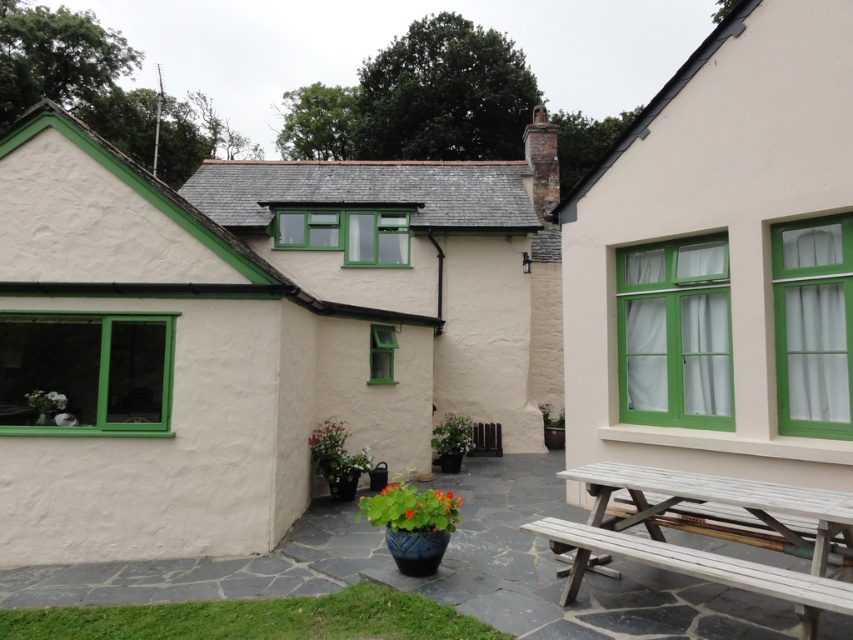
You are standing in the courtyard of the house and want to sit on the light brown wooden bench at lower right. Which direction should you walk to reach it without passing through the white stucco cottage at left?

The light brown wooden bench at lower right is behind the white stucco cottage at left, so you should walk around the cottage to reach the bench without passing through it.

You are standing in the courtyard of the house and want to sit down. There is a white stucco cottage at left and a light brown wooden bench at lower right. Which object should you approach to sit?

You should approach the light brown wooden bench at lower right because it is a bench designed for sitting, while the white stucco cottage at left is a building structure and not meant for sitting.

You are standing in the courtyard of the house and want to sit down. You see the white wood picnic table at right and the light brown wooden bench at lower right. Which one is closer to you?

The white wood picnic table at right is closer to you because it is further to the viewer than the light brown wooden bench at lower right.